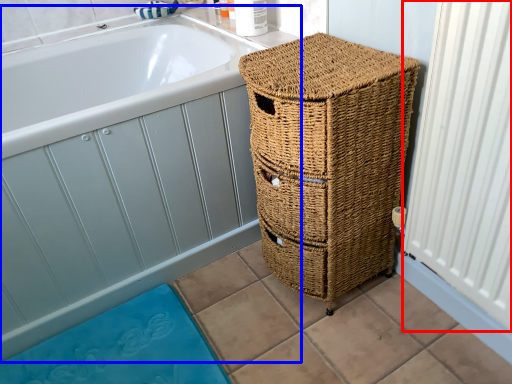
Question: Which of the following is the closest to the observer, radiator (highlighted by a red box) or bath (highlighted by a blue box)?

Choices:
 (A) radiator
 (B) bath

Answer: (A)